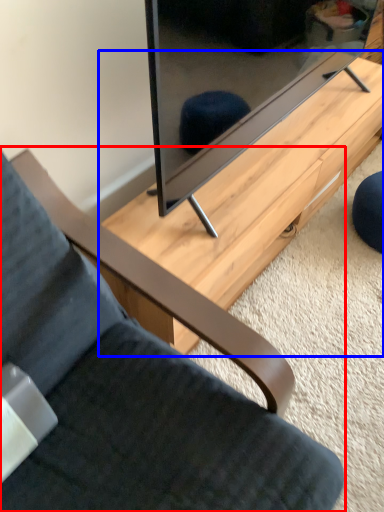
Question: Among these objects, which one is nearest to the camera, chair (highlighted by a red box) or table (highlighted by a blue box)?

Choices:
 (A) chair
 (B) table

Answer: (A)